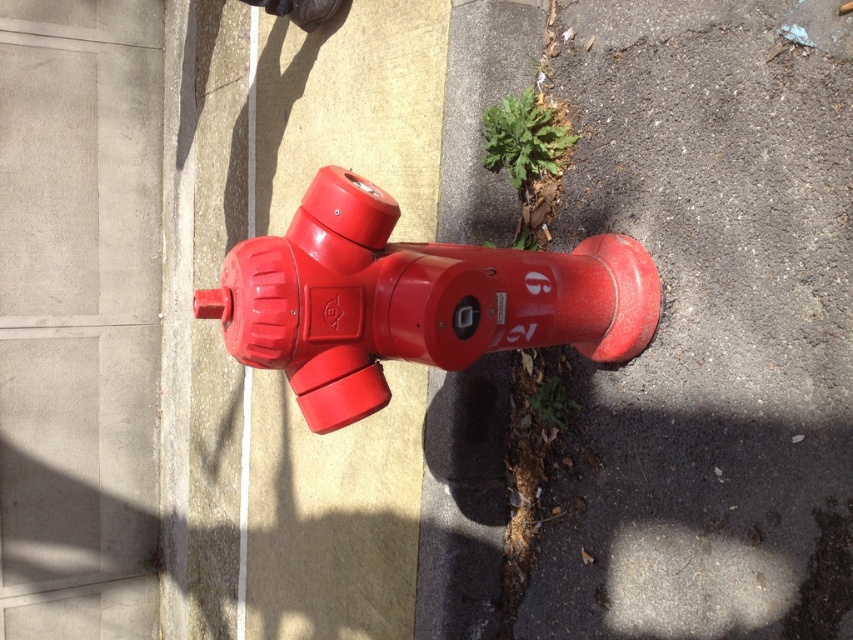
You are a delivery person trying to park your bike between the glossy plastic hydrant at center and the green leafy plant at lower center. Can your bike, which is 1.2 meters wide, fit in the space between them?

The glossy plastic hydrant at center is wider than the green leafy plant at lower center, but the description does not provide the exact width of either object or the distance between them. Therefore, it is impossible to determine if the bike can fit based on the given information.

You are a delivery person trying to park your bike. The white line on the sidewalk prohibits parking beyond it. If you park your bike between the smooth asphalt at lower right and the green leafy plant at lower center, will you be violating the parking rule?

The smooth asphalt at lower right is to the right of the green leafy plant at lower center. Since the white line is painted along the edge of the sidewalk, parking between them would place your bike beyond the white line, violating the parking rule.

You are a delivery driver who needs to park your van near the glossy plastic hydrant at center. The van requires a space that is 3 meters wide. The smooth asphalt at lower right is 4 meters wide. Can you safely park your van there without blocking the hydrant?

The smooth asphalt at lower right is 4 meters wide, which is wider than the van requires. Since it is to the right of the glossy plastic hydrant at center, parking there would keep the hydrant accessible and not block it. Yes, you can safely park there.